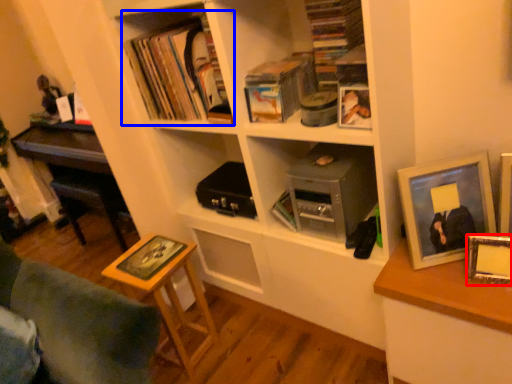
Question: Which of the following is the closest to the observer, picture frame (highlighted by a red box) or book (highlighted by a blue box)?

Choices:
 (A) picture frame
 (B) book

Answer: (A)